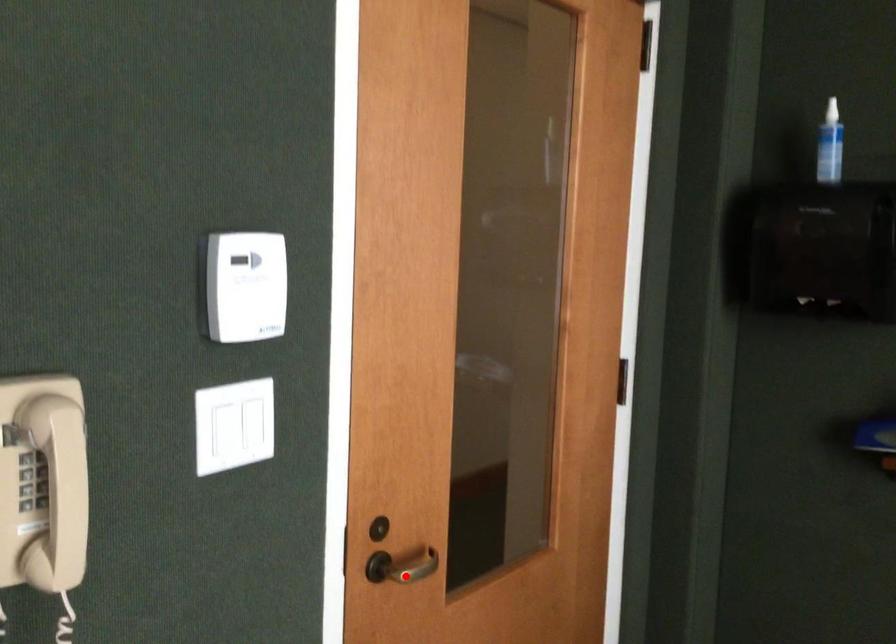
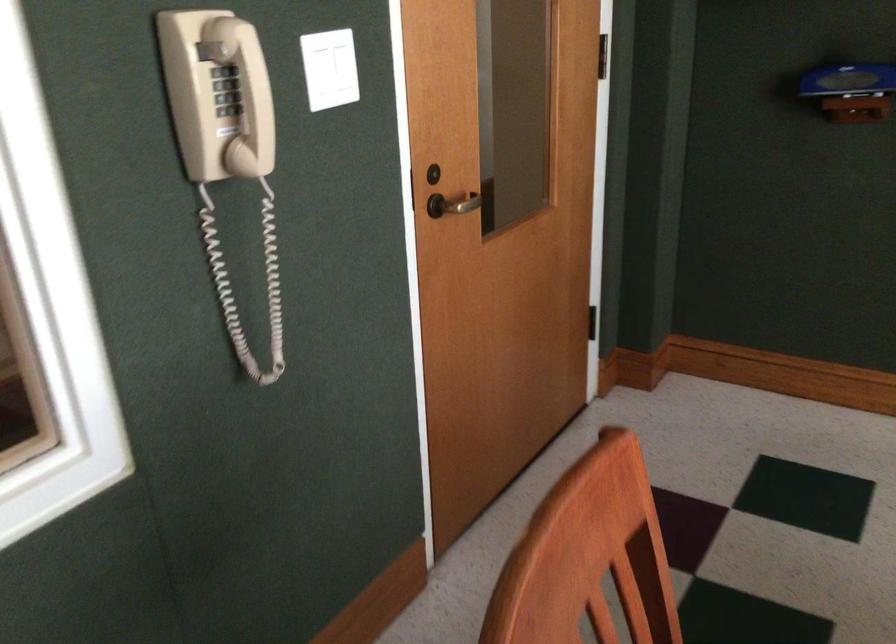
The point at the highlighted location is marked in the first image. Where is the corresponding point in the second image?

(458, 204)